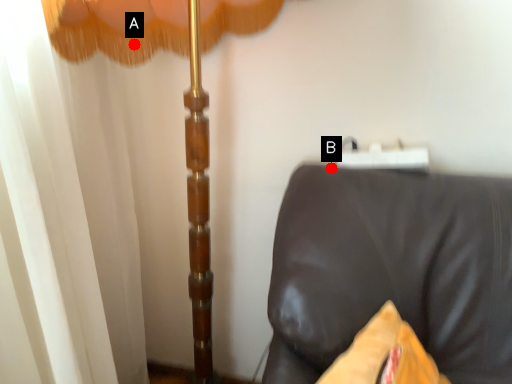
Question: Two points are circled on the image, labeled by A and B beside each circle. Among these points, which one is farthest from the camera?

Choices:
 (A) A is further
 (B) B is further

Answer: (B)